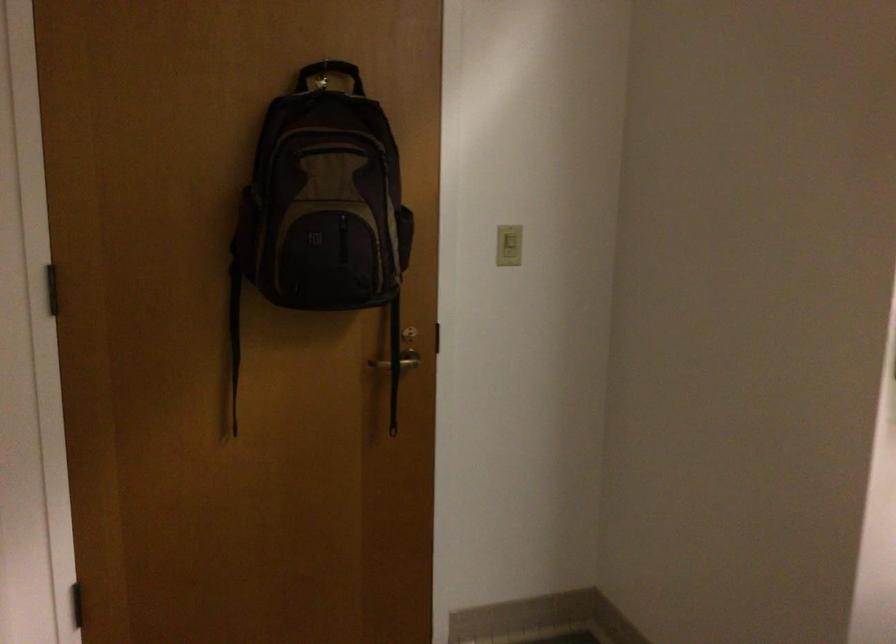
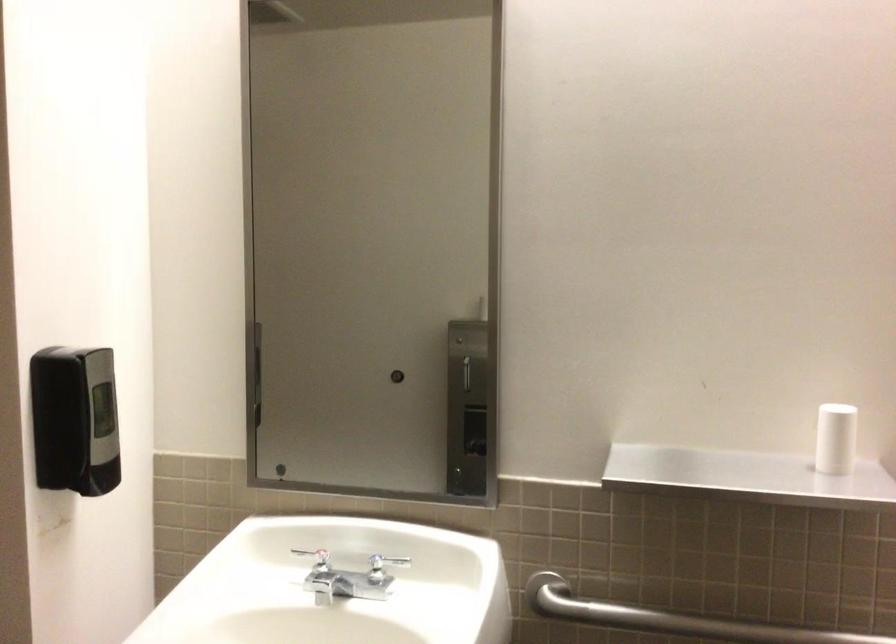
Question: How did the camera likely rotate?

Choices:
 (A) Left
 (B) Right
 (C) Up
 (D) Down

Answer: (B)